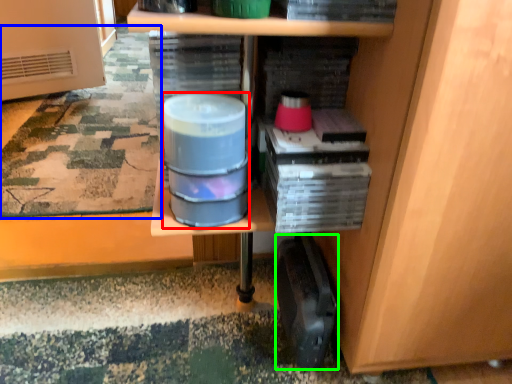
Question: Considering the real-world distances, which object is closest to water (highlighted by a red box)? mat (highlighted by a blue box) or wide (highlighted by a green box).

Choices:
 (A) mat
 (B) wide

Answer: (B)